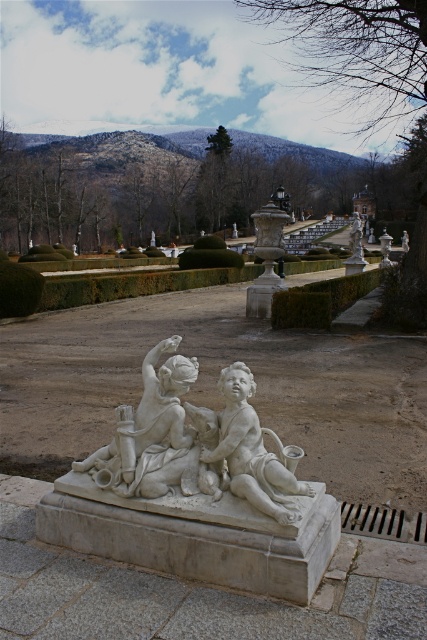
You are standing in the garden and want to reach the point marked at coordinates (231, 378). If you walk straight ahead, will you arrive at that point within 4 meters?

The point marked at coordinates (231, 378) is 3.29 meters away from you, so yes, you can reach it within 4 meters by walking straight ahead.

You are a tour guide giving a tour of the garden. You want to mention the relative heights of the white marble sculpture at center and the white marble statue at upper right. How would you describe their sizes?

The white marble statue at upper right is taller than the white marble sculpture at center.